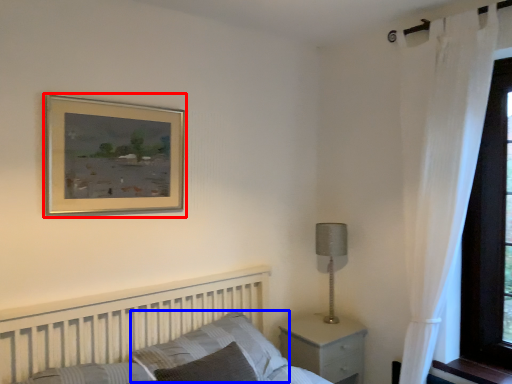
Question: Which object appears closest to the camera in this image, picture frame (highlighted by a red box) or pillow (highlighted by a blue box)?

Choices:
 (A) picture frame
 (B) pillow

Answer: (B)